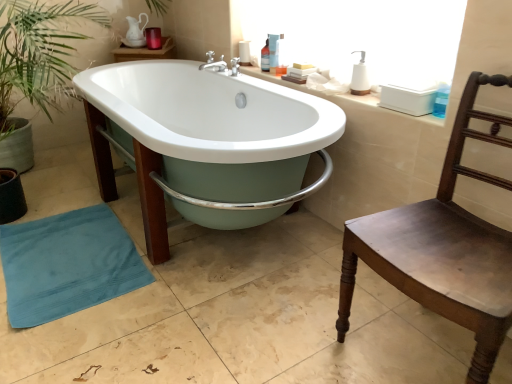
Identify the location of free space above white ceramic counter top at upper right (from a real-world perspective). The image size is (512, 384). (323, 91).